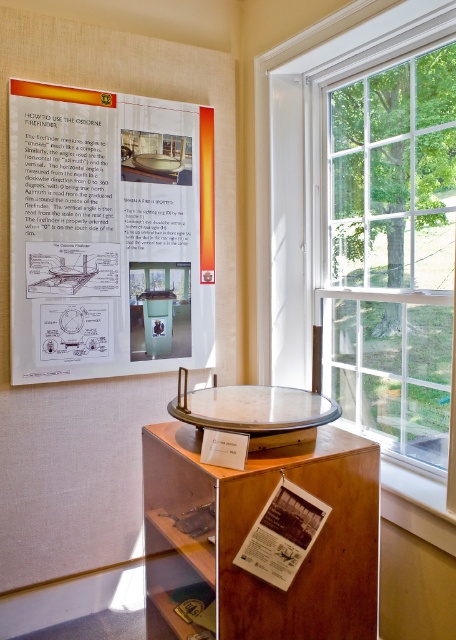
You are a visitor standing in front of the metallic polished table at center, and you want to look out through the clear glass window at right. Which direction should you move to get closer to the window?

You should move to the right side of the metallic polished table at center to get closer to the clear glass window at right.

You are a visitor at the museum and want to take a photo of the metallic polished table at center through the clear glass window at right. Can you do that?

The clear glass window at right is to the right of the metallic polished table at center, so you can take a photo of the metallic polished table at center through the clear glass window at right as they are positioned in a way that allows visibility.

You are a visitor at the museum and want to take a photo of the white paper at center and the clear glass window at right. Your camera can only focus on objects within 1 meter of each other. Can you take the photo without moving either object?

The clear glass window at right is 98.18 centimeters away from the white paper at center. Since 98.18 cm is less than 1 meter, the camera can focus on both objects, so yes, you can take the photo without moving them.